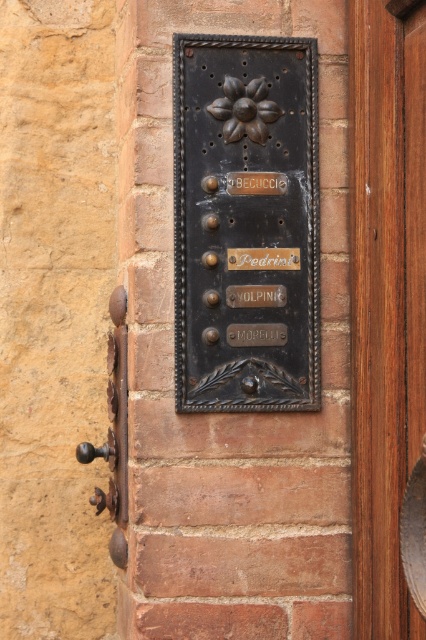
Based on the photo, you are standing in front of the brick wall with the wooden door frame on the right. You notice a point marked at coordinates [245,224]. Based on the scene description, what object is located at that point?

The point at coordinates [245,224] corresponds to the matte black plaque at center.

You are standing in front of a brick wall with a wooden door frame on the right. You need to locate the exact position of the brown wooden door at right. What are its coordinates?

The brown wooden door at right is located at coordinates point [385,298].

You are standing in front of a brick wall with a wooden door frame. You notice two points marked on the wall at coordinates point [276,72] and point [109,403]. Which point is physically closer to your eyes?

Point [276,72] is closer to the camera than point [109,403], so the point closer to your eyes is point [276,72].